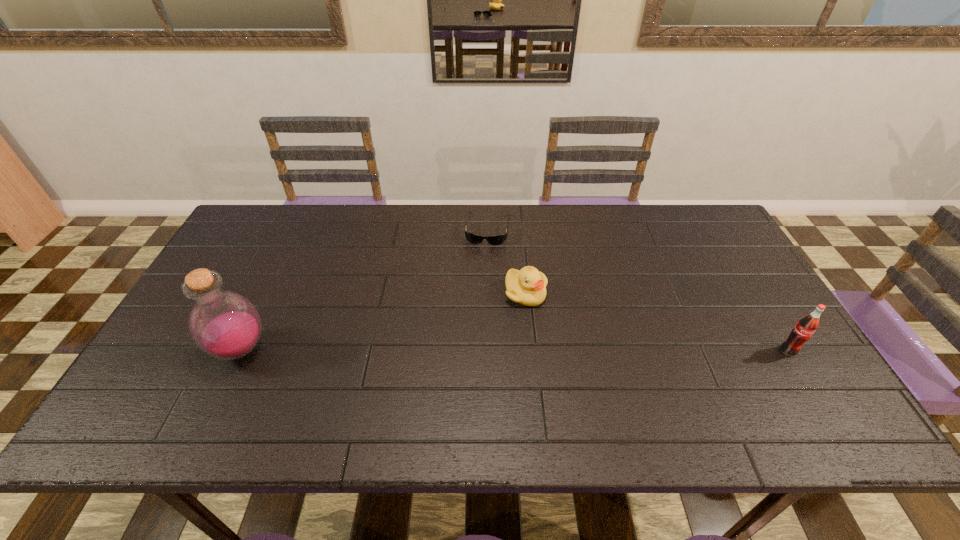
Identify the location of object present at the near left corner. This screenshot has width=960, height=540. (225, 325).

What are the coordinates of `vacant region at the far edge of the desktop` in the screenshot? It's located at (658, 220).

This screenshot has width=960, height=540. I want to click on free region at the near edge, so click(x=527, y=386).

Where is `free region at the left edge of the desktop`? free region at the left edge of the desktop is located at coordinates (241, 282).

Find the location of `free spot at the right edge of the desktop`. free spot at the right edge of the desktop is located at coordinates (711, 255).

In the image, there is a desktop. At what (x,y) coordinates should I click in order to perform the action: click on vacant space at the far left corner. Please return your answer as a coordinate pair (x, y). Looking at the image, I should click on (255, 223).

Where is `free space at the far right corner of the desktop`? free space at the far right corner of the desktop is located at coordinates (708, 236).

The height and width of the screenshot is (540, 960). In the image, there is a desktop. Find the location of `blank space at the near right corner`. blank space at the near right corner is located at coordinates (746, 368).

Find the location of `free area in between the rightmost object and the bottle`. free area in between the rightmost object and the bottle is located at coordinates (515, 350).

Locate an element on the screen. This screenshot has width=960, height=540. free space between the soda bottle and the farthest object is located at coordinates (638, 289).